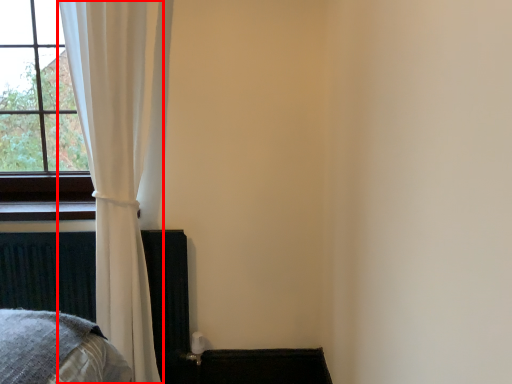
Question: From the image, what is the correct spatial relationship of curtain (annotated by the red box) in relation to bed frame?

Choices:
 (A) right
 (B) left

Answer: (A)